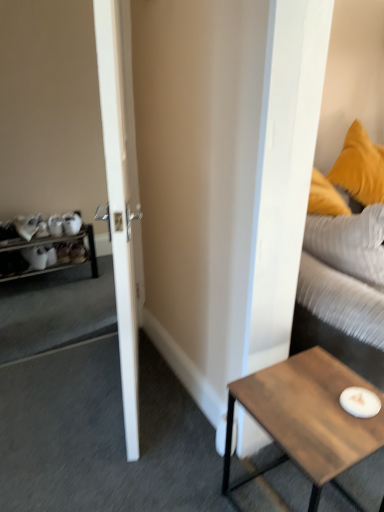
Question: Is white glossy door at left outside wooden shelf at left?

Choices:
 (A) no
 (B) yes

Answer: (B)

Question: Would you say white glossy door at left is a long distance from wooden shelf at left?

Choices:
 (A) yes
 (B) no

Answer: (A)

Question: Does white glossy door at left have a lesser width compared to wooden shelf at left?

Choices:
 (A) no
 (B) yes

Answer: (B)

Question: Can you confirm if white glossy door at left is taller than wooden shelf at left?

Choices:
 (A) yes
 (B) no

Answer: (A)

Question: Is white glossy door at left at the left side of wooden shelf at left?

Choices:
 (A) no
 (B) yes

Answer: (A)

Question: Does white glossy door at left have a larger size compared to wooden shelf at left?

Choices:
 (A) yes
 (B) no

Answer: (A)

Question: Is wooden coffee table at lower right facing towards velvet yellow pillow at upper right?

Choices:
 (A) yes
 (B) no

Answer: (B)

Question: Does wooden coffee table at lower right lie in front of velvet yellow pillow at upper right?

Choices:
 (A) yes
 (B) no

Answer: (A)

Question: From the image's perspective, is wooden coffee table at lower right beneath velvet yellow pillow at upper right?

Choices:
 (A) no
 (B) yes

Answer: (B)

Question: Is wooden coffee table at lower right positioned far away from velvet yellow pillow at upper right?

Choices:
 (A) yes
 (B) no

Answer: (B)

Question: Can you confirm if wooden coffee table at lower right is bigger than velvet yellow pillow at upper right?

Choices:
 (A) no
 (B) yes

Answer: (A)

Question: Is wooden coffee table at lower right taller than velvet yellow pillow at upper right?

Choices:
 (A) yes
 (B) no

Answer: (B)

Question: Considering the relative positions of wooden coffee table at lower right and wooden shelf at left in the image provided, is wooden coffee table at lower right to the left of wooden shelf at left from the viewer's perspective?

Choices:
 (A) no
 (B) yes

Answer: (A)